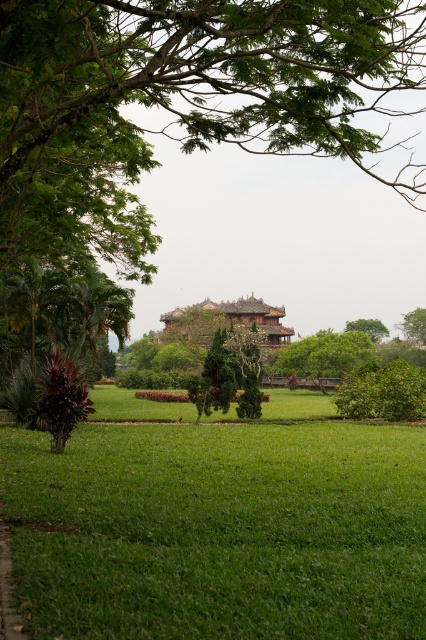
You are standing at the park entrance and want to walk directly to the brown wooden palace at center. There is a green textured tree at center blocking your path. Can you walk straight to the palace without going around the tree?

The brown wooden palace at center is 16.68 meters away from the green textured tree at center, so yes, you can walk straight to the brown wooden palace at center without going around the green textured tree at center since they are not in the same location.

You are standing in the park and see the green textured tree at center and the green leafy tree at upper center. Which tree is positioned more to the left side of the park?

The green textured tree at center is positioned more to the left side of the park than the green leafy tree at upper center.

You are standing at the center of the grassy area in the park. There is a point marked at coordinates (213, 380). What object is located at that point?

The point at coordinates (213, 380) corresponds to a green textured tree at center.